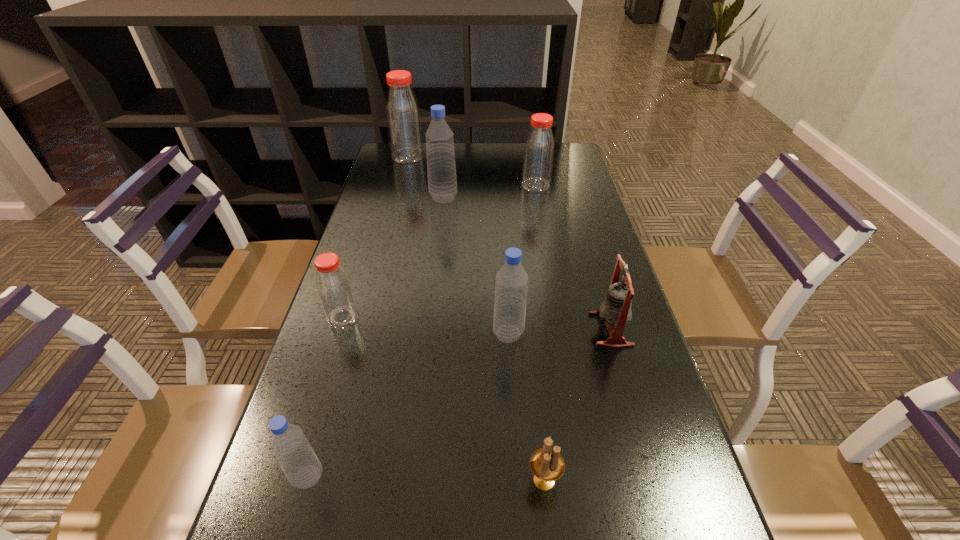
You are a GUI agent. You are given a task and a screenshot of the screen. Output one action in this format:
    pyautogui.click(x=<x>, y=<y>)
    Task: Click on the nearest bottle
    The width and height of the screenshot is (960, 540).
    Given the screenshot: What is the action you would take?
    pyautogui.click(x=297, y=459)

Locate an element on the screen. The image size is (960, 540). the smallest blue bottle is located at coordinates (297, 459).

At what (x,y) coordinates should I click in order to perform the action: click on candle holder. Please return your answer as a coordinate pair (x, y). The height and width of the screenshot is (540, 960). Looking at the image, I should click on (547, 465).

Find the location of a particular element. The image size is (960, 540). vacant space located 0.210m on the back of the biggest blue bottle is located at coordinates (447, 161).

Find the location of a particular element. blank space located on the front of the farthest red bottle is located at coordinates (400, 184).

Locate an element on the screen. vacant space positioned 0.300m on the front of the second smallest red bottle is located at coordinates (547, 249).

I want to click on vacant space located on the left of the fifth bottle from left to right, so click(449, 334).

You are a GUI agent. You are given a task and a screenshot of the screen. Output one action in this format:
    pyautogui.click(x=<x>, y=<y>)
    Task: Click on the free region located on the back of the rightmost object
    The height and width of the screenshot is (540, 960).
    Given the screenshot: What is the action you would take?
    click(591, 262)

Find the location of a particular element. The height and width of the screenshot is (540, 960). vacant space located 0.150m on the back of the smallest red bottle is located at coordinates (359, 266).

Locate an element on the screen. This screenshot has height=540, width=960. free space located 0.350m on the right of the nearest blue bottle is located at coordinates (524, 477).